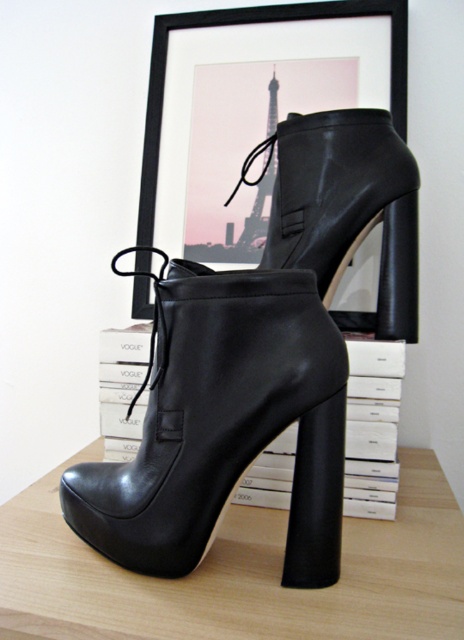
Question: Based on their relative distances, which object is nearer to the black matte frame at upper center?

Choices:
 (A) black leather platform boot at center
 (B) metallic silver eiffel tower at center

Answer: (B)

Question: Is black leather boot at center positioned before black leather platform boot at center?

Choices:
 (A) yes
 (B) no

Answer: (B)

Question: Among these objects, which one is nearest to the camera?

Choices:
 (A) metallic silver eiffel tower at center
 (B) black leather boot at center
 (C) black leather platform boot at center
 (D) black matte frame at upper center

Answer: (C)

Question: Which of the following is the farthest from the observer?

Choices:
 (A) (419, 608)
 (B) (275, 99)

Answer: (B)

Question: Can you confirm if black leather boot at center is bigger than black matte frame at upper center?

Choices:
 (A) no
 (B) yes

Answer: (A)

Question: Is black leather boot at center above black leather platform boot at center?

Choices:
 (A) no
 (B) yes

Answer: (B)